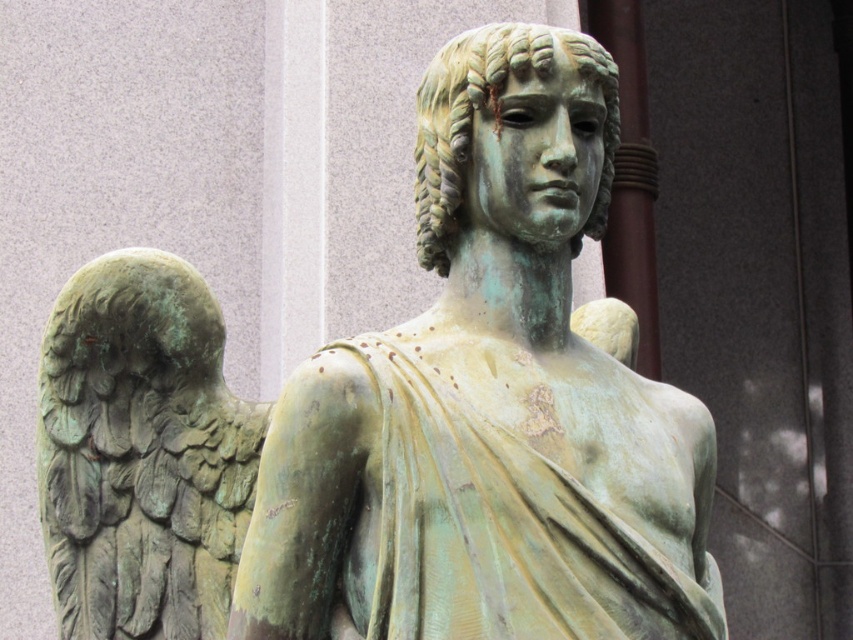
You are an art conservator examining the bronze statue. You notice the green patina on both the statue and the wings. Which part of the statue, the green patina statue at center or the green patina wings at left, is positioned closer to you?

The green patina statue at center is closer to the viewer than the green patina wings at left.

You are an art conservator examining the bronze statue. You need to determine which part requires more support due to its height. Which is taller between the green patina statue at center and the green patina wings at left?

The green patina statue at center is much taller than the green patina wings at left, so the statue at center requires more support due to its height.

You are an art conservator assessing the statue. You need to determine if the green patina statue at center can be placed on a pedestal that is narrower than the green patina wings at left. Is this possible?

The green patina statue at center might be wider than green patina wings at left, so placing it on a pedestal narrower than the wings could be risky. The statue might not fit if its width exceeds the pedestal.